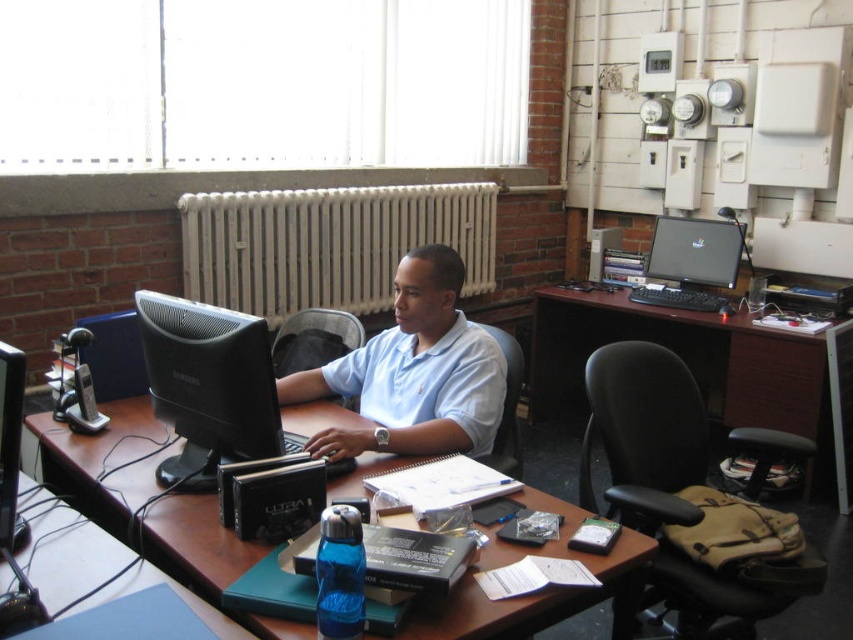
Consider the image. You are organizing a meeting in the office and need to place a 1.2 meter long tablecloth on the brown wooden table at center. Given the table coordinates at point 0.928, 0.631, can you determine if the tablecloth will fit based on the table dimensions?

The brown wooden table at center is located at point [537,593], but without knowing the table dimensions, it is impossible to determine if the 1.2 meter long tablecloth will fit. Additional information about the table size is required.

You are organizing a small event and need to place a 1.2 meter long banner horizontally on the desk. The banner must be placed between the white metal radiator at center and the satin black monitor at center. Based on their sizes, will the banner fit between them?

The white metal radiator at center is larger in size than the satin black monitor at center, so the space between them may not be sufficient to accommodate a 1.2 meter long banner horizontally. You should check the actual distance between them for accuracy.